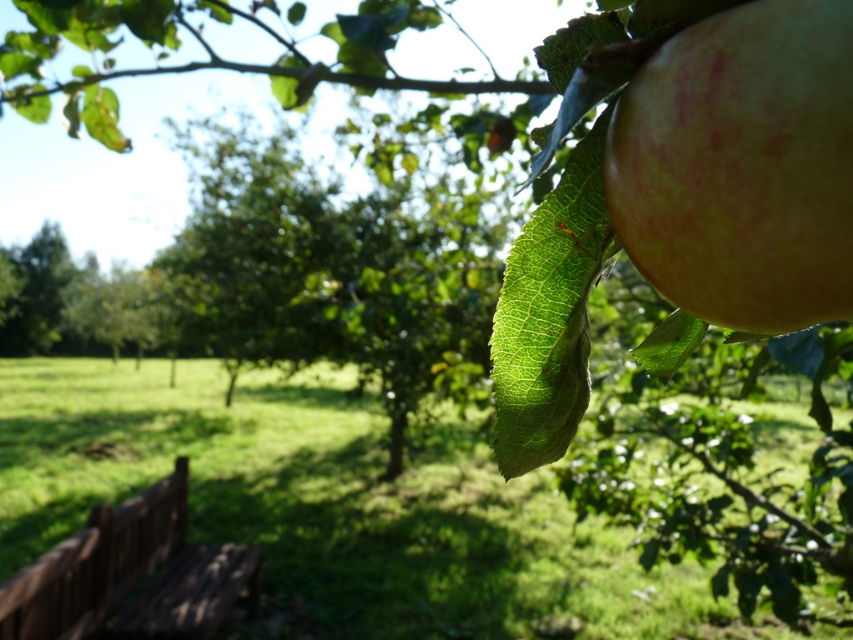
You are holding a camera and want to take a photo of the apple in the orchard scene. The camera can only focus on objects within 10 inches. Is the point at coordinates point (798, 4) within the focus range?

The point at coordinates point (798, 4) is 12.27 inches away from the camera, which exceeds the 10 inch focus range. Therefore, the camera cannot focus on this point.